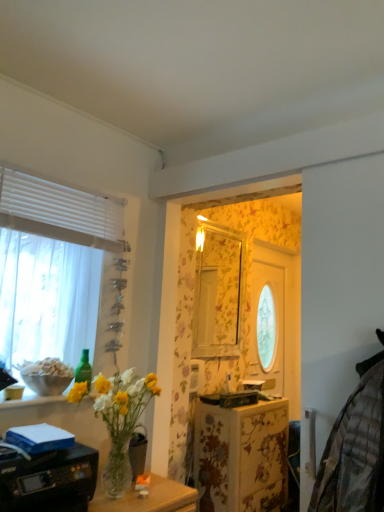
Question: Considering the relative sizes of white sheer curtain at left and clear glass vase at lower left in the image provided, is white sheer curtain at left bigger than clear glass vase at lower left?

Choices:
 (A) yes
 (B) no

Answer: (B)

Question: Can we say white sheer curtain at left lies outside clear glass vase at lower left?

Choices:
 (A) no
 (B) yes

Answer: (B)

Question: From a real-world perspective, is white sheer curtain at left beneath clear glass vase at lower left?

Choices:
 (A) no
 (B) yes

Answer: (A)

Question: Is white sheer curtain at left taller than clear glass vase at lower left?

Choices:
 (A) no
 (B) yes

Answer: (B)

Question: Is white sheer curtain at left positioned behind clear glass vase at lower left?

Choices:
 (A) no
 (B) yes

Answer: (B)

Question: In the image, is black plastic printer at lower left positioned in front of or behind clear glass vase at lower left?

Choices:
 (A) front
 (B) behind

Answer: (A)

Question: From the image's perspective, is black plastic printer at lower left positioned above or below clear glass vase at lower left?

Choices:
 (A) below
 (B) above

Answer: (A)

Question: Looking at the image, does black plastic printer at lower left seem bigger or smaller compared to clear glass vase at lower left?

Choices:
 (A) small
 (B) big

Answer: (A)

Question: Is black plastic printer at lower left spatially inside clear glass vase at lower left, or outside of it?

Choices:
 (A) inside
 (B) outside

Answer: (B)

Question: From a real-world perspective, is clear glass vase at lower center physically located above or below black plastic printer at lower left?

Choices:
 (A) above
 (B) below

Answer: (B)

Question: Considering the positions of point (183, 505) and point (36, 477), is point (183, 505) closer or farther from the camera than point (36, 477)?

Choices:
 (A) farther
 (B) closer

Answer: (A)

Question: From their relative heights in the image, would you say clear glass vase at lower center is taller or shorter than black plastic printer at lower left?

Choices:
 (A) short
 (B) tall

Answer: (B)

Question: Choose the correct answer: Is clear glass vase at lower center inside black plastic printer at lower left or outside it?

Choices:
 (A) outside
 (B) inside

Answer: (A)

Question: Relative to green glass bottle at upper left, is clear glass vase at lower center in front or behind?

Choices:
 (A) front
 (B) behind

Answer: (A)

Question: Does point (175, 508) appear closer or farther from the camera than point (77, 370)?

Choices:
 (A) closer
 (B) farther

Answer: (A)